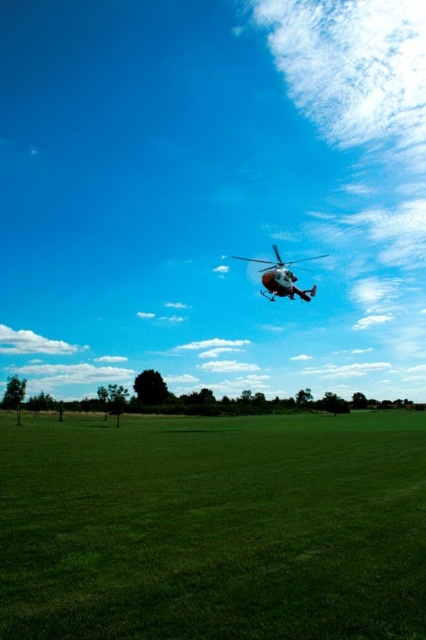
Question: Which point appears closest to the camera in this image?

Choices:
 (A) (43, 445)
 (B) (294, 262)

Answer: (A)

Question: Among these points, which one is farthest from the camera?

Choices:
 (A) (425, 563)
 (B) (267, 289)

Answer: (B)

Question: Can you confirm if green grass at center is positioned to the right of white matte helicopter at upper center?

Choices:
 (A) yes
 (B) no

Answer: (B)

Question: Does green grass at center appear on the left side of white matte helicopter at upper center?

Choices:
 (A) yes
 (B) no

Answer: (A)

Question: Does green grass at center have a smaller size compared to white matte helicopter at upper center?

Choices:
 (A) no
 (B) yes

Answer: (B)

Question: Among these objects, which one is farthest from the camera?

Choices:
 (A) green grass at center
 (B) white matte helicopter at upper center

Answer: (B)